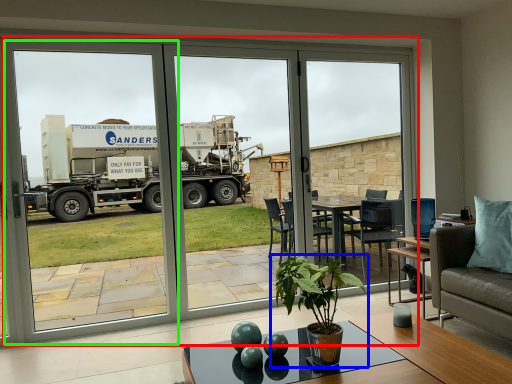
Question: Based on their relative distances, which object is farther from door (highlighted by a red box)? Choose from houseplant (highlighted by a blue box) and screen door (highlighted by a green box).

Choices:
 (A) houseplant
 (B) screen door

Answer: (B)